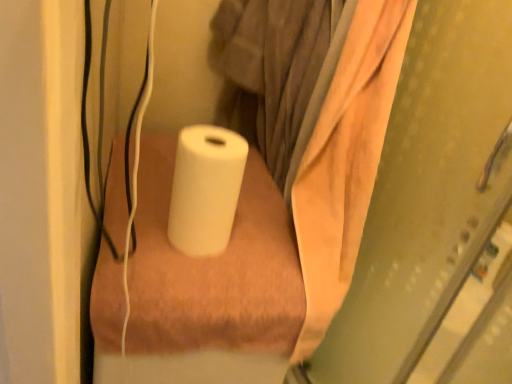
What do you see at coordinates (205, 189) in the screenshot?
I see `white matte paper towel at center` at bounding box center [205, 189].

Locate an element on the screen. This screenshot has height=384, width=512. white matte paper towel at center is located at coordinates (205, 189).

You are a GUI agent. You are given a task and a screenshot of the screen. Output one action in this format:
    pyautogui.click(x=<x>, y=<y>)
    Task: Click on the white matte paper towel at center
    The width and height of the screenshot is (512, 384).
    Given the screenshot: What is the action you would take?
    pyautogui.click(x=205, y=189)